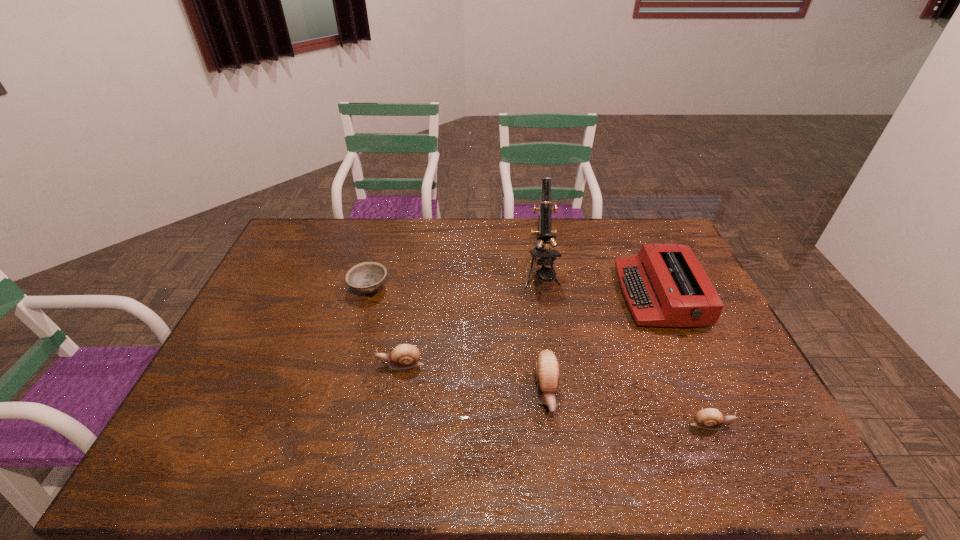
Please point a vacant point for placing a escargot on the left. Please provide its 2D coordinates. Your answer should be formatted as a tuple, i.e. [(x, y)], where the tuple contains the x and y coordinates of a point satisfying the conditions above.

[(271, 339)]